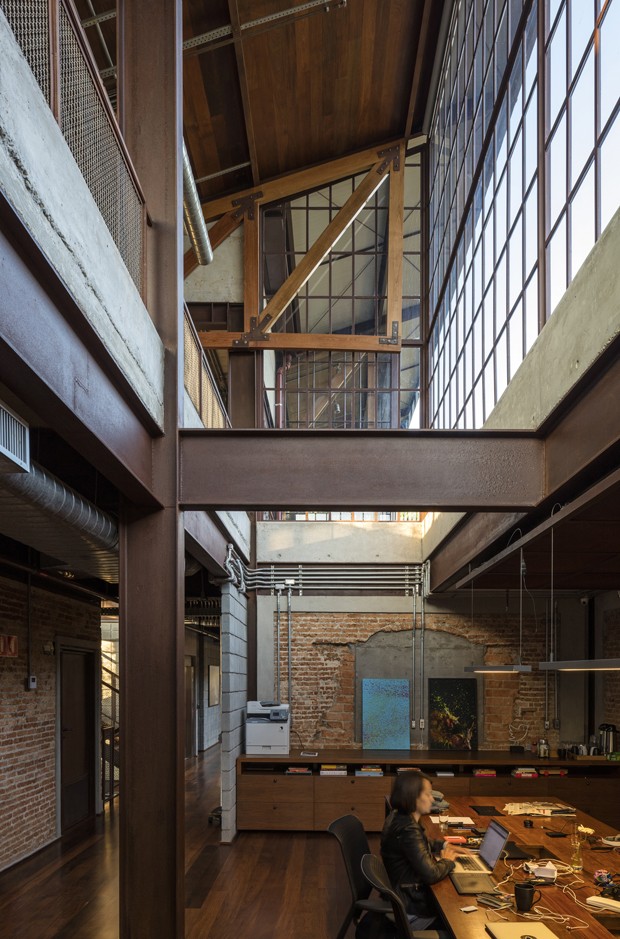
What are the coordinates of `laptop` in the screenshot? It's located at (488, 870).